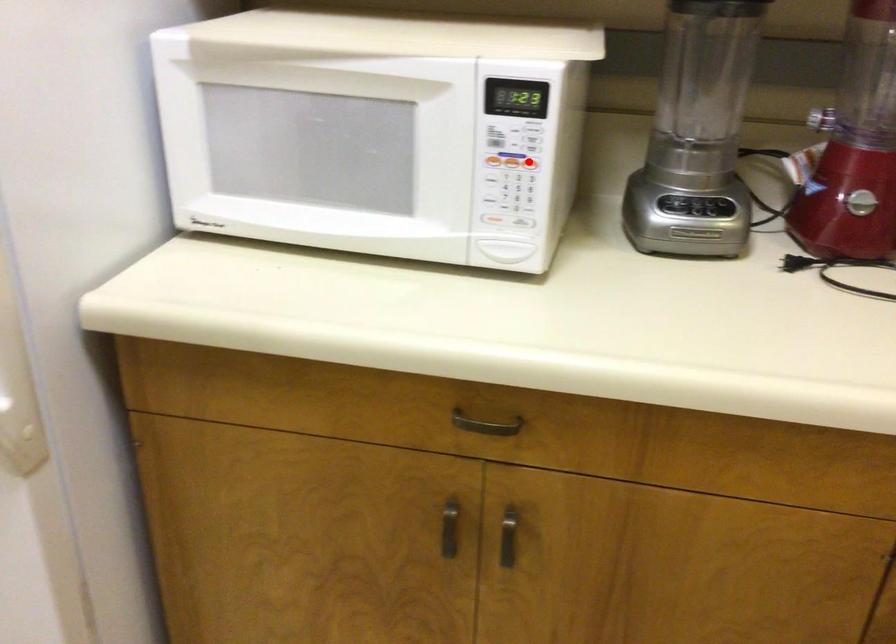
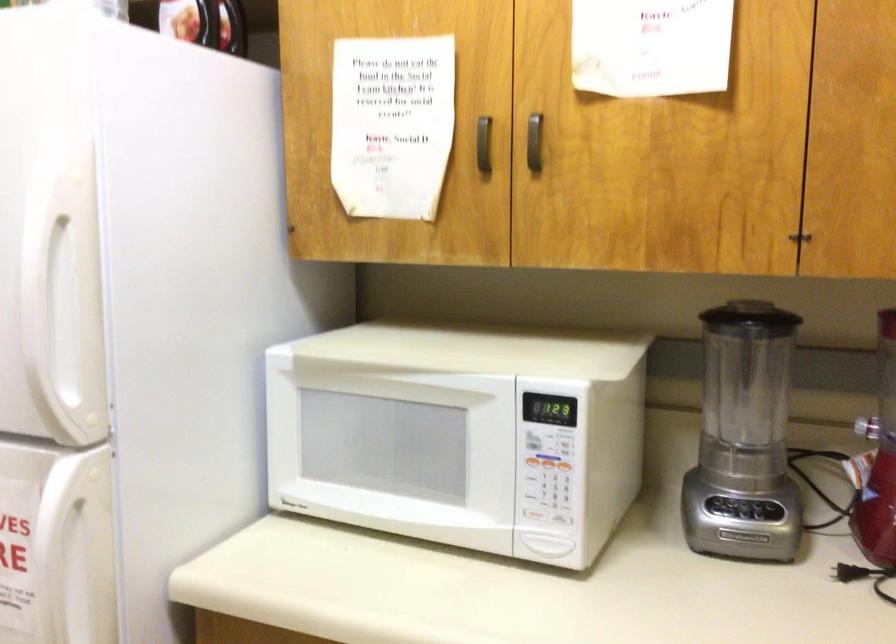
Question: I am providing you with two images of the same scene from different viewpoints. Given a red point in image1, look at the same physical point in image2. Is it:

Choices:
 (A) Closer to the viewpoint
 (B) Farther from the viewpoint

Answer: (B)